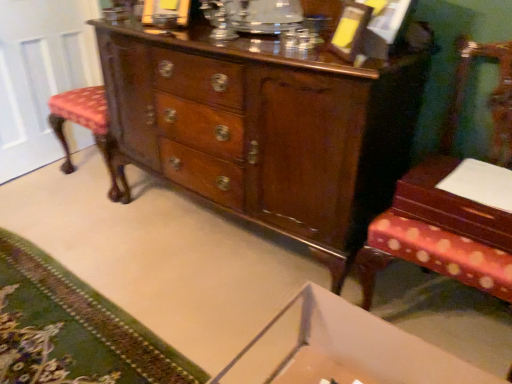
Question: Which direction should I rotate to look at white cardboard changing table at lower center?

Choices:
 (A) left
 (B) right

Answer: (B)

Question: Is white glossy door at left located within white cardboard changing table at lower center?

Choices:
 (A) yes
 (B) no

Answer: (B)

Question: Considering the relative positions of white cardboard changing table at lower center and white glossy door at left in the image provided, is white cardboard changing table at lower center to the left of white glossy door at left from the viewer's perspective?

Choices:
 (A) no
 (B) yes

Answer: (A)

Question: Is white cardboard changing table at lower center thinner than white glossy door at left?

Choices:
 (A) yes
 (B) no

Answer: (B)

Question: Does white cardboard changing table at lower center have a greater height compared to white glossy door at left?

Choices:
 (A) no
 (B) yes

Answer: (A)

Question: Is white cardboard changing table at lower center facing towards white glossy door at left?

Choices:
 (A) no
 (B) yes

Answer: (A)

Question: Would you consider white cardboard changing table at lower center to be distant from white glossy door at left?

Choices:
 (A) no
 (B) yes

Answer: (B)

Question: Is white cardboard changing table at lower center thinner than mahogany wood table at right?

Choices:
 (A) no
 (B) yes

Answer: (A)

Question: Considering the relative sizes of white cardboard changing table at lower center and mahogany wood table at right in the image provided, is white cardboard changing table at lower center smaller than mahogany wood table at right?

Choices:
 (A) yes
 (B) no

Answer: (B)

Question: Would you say mahogany wood table at right is part of white cardboard changing table at lower center's contents?

Choices:
 (A) yes
 (B) no

Answer: (B)

Question: Can you confirm if white cardboard changing table at lower center is shorter than mahogany wood table at right?

Choices:
 (A) yes
 (B) no

Answer: (B)

Question: From a real-world perspective, is white cardboard changing table at lower center under mahogany wood table at right?

Choices:
 (A) no
 (B) yes

Answer: (B)

Question: Is white cardboard changing table at lower center to the right of mahogany wood table at right from the viewer's perspective?

Choices:
 (A) no
 (B) yes

Answer: (A)

Question: Is mahogany wood table at right shorter than white glossy door at left?

Choices:
 (A) no
 (B) yes

Answer: (B)